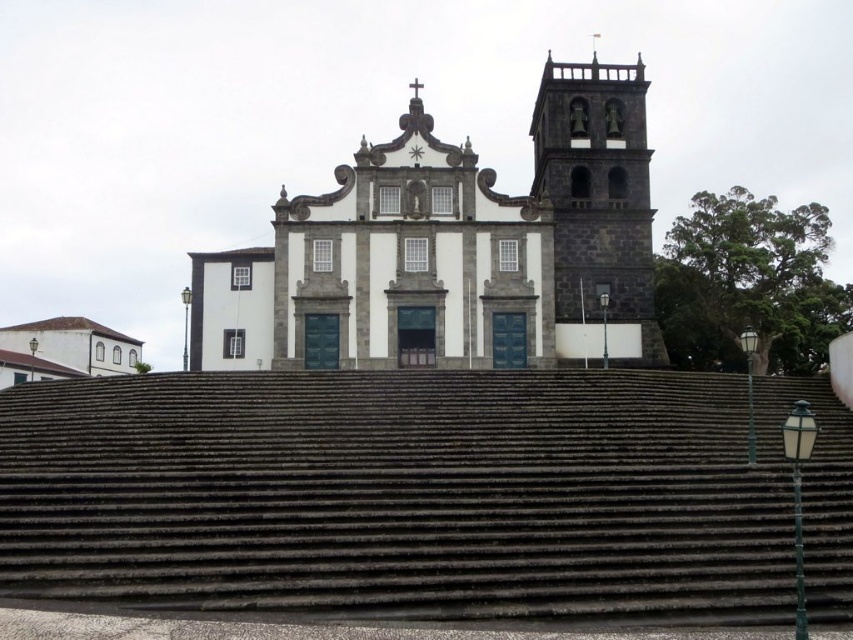
Does white stone church at center appear over dark gray stone bell tower at upper right?

Incorrect, white stone church at center is not positioned above dark gray stone bell tower at upper right.

From the picture: Who is positioned more to the right, white stone church at center or dark gray stone bell tower at upper right?

dark gray stone bell tower at upper right

Is point (450, 296) less distant than point (596, 132)?

Yes, point (450, 296) is closer to viewer.

Where is `white stone church at center`? This screenshot has width=853, height=640. white stone church at center is located at coordinates (454, 250).

In the scene shown: Is dark gray stone stairs at center thinner than dark gray stone bell tower at upper right?

No, dark gray stone stairs at center is not thinner than dark gray stone bell tower at upper right.

Is dark gray stone stairs at center taller than dark gray stone bell tower at upper right?

No, dark gray stone stairs at center is not taller than dark gray stone bell tower at upper right.

Is point (828, 492) behind point (640, 84)?

No, it is in front of (640, 84).

I want to click on dark gray stone stairs at center, so click(424, 493).

I want to click on dark gray stone stairs at center, so click(424, 493).

In the scene shown: Between dark gray stone stairs at center and white stone church at center, which one has more height?

With more height is white stone church at center.

You are a GUI agent. You are given a task and a screenshot of the screen. Output one action in this format:
    pyautogui.click(x=<x>, y=<y>)
    Task: Click on the dark gray stone stairs at center
    
    Given the screenshot: What is the action you would take?
    pyautogui.click(x=424, y=493)